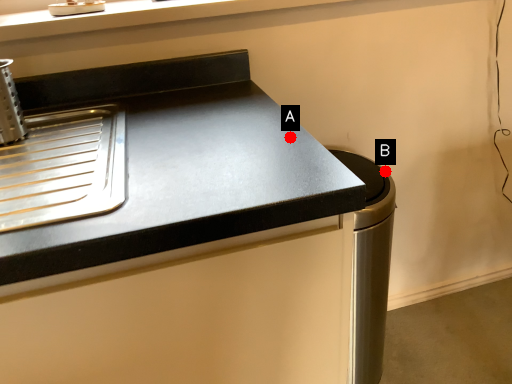
Question: Two points are circled on the image, labeled by A and B beside each circle. Which point appears farthest from the camera in this image?

Choices:
 (A) A is further
 (B) B is further

Answer: (B)